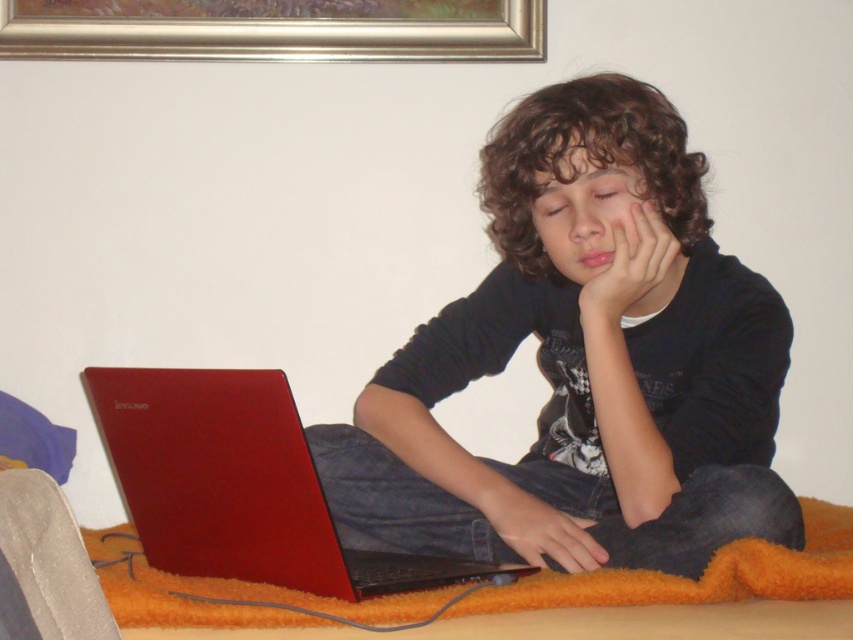
You are a delivery person who needs to place a small package on either the matte black shirt at center or the orange fuzzy blanket at lower center. Which surface would be more stable for placing the package?

The orange fuzzy blanket at lower center is more stable for placing the package because the matte black shirt at center is above it, meaning the blanket is likely on a solid surface like the floor or a table, while the shirt is on the person and might move.

Based on the photo, you are a photographer trying to capture the scene of a person using a laptop. You want to ensure both the matte red laptop at center and the matte skin hand at center are clearly visible in your photo. Given their sizes, which object should you focus on first to ensure proper framing?

The matte red laptop at center is bigger than the matte skin hand at center, so you should focus on the matte red laptop at center first to ensure proper framing since it occupies more space in the scene.

You are a delivery person who needs to place a small package on the floor near the point marked at coordinates (x=239, y=484). The package must be placed such that it doesn not interfere with the person or the laptop. Can you confirm if there is enough space around the point to place the package?

The point (x=239, y=484) has the matte red laptop at center located there. Since the laptop is at that point, placing a package directly there would interfere with it. You should choose a different location away from the laptop and the person to ensure safety and accessibility.